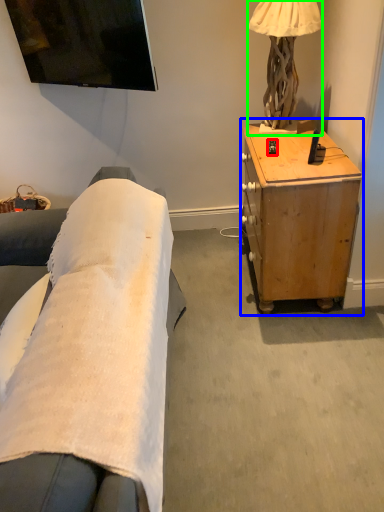
Question: Based on their relative distances, which object is farther from remote control (highlighted by a red box)? Choose from desk (highlighted by a blue box) and lamp (highlighted by a green box).

Choices:
 (A) desk
 (B) lamp

Answer: (A)